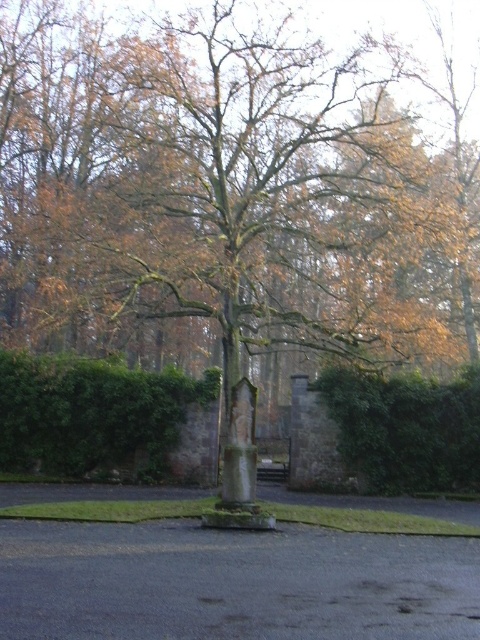
In the scene shown: You are a gardener planning to install a new sprinkler system between the green leafy hedge at center and the green leafy hedge at right. The sprinkler has a maximum coverage radius of 12 feet. Can the sprinkler effectively water both hedges without moving it?

The distance between the green leafy hedge at center and the green leafy hedge at right is 24.77 feet. Since the sprinkler has a maximum coverage radius of 12 feet, the total coverage diameter would be 24 feet. However, 24.77 feet exceeds this, so the sprinkler cannot effectively water both hedges without moving it.

You are standing in the paved area near the stone cross and want to walk to the green leafy hedge at right. Which direction should you move relative to the green leafy hedge at center?

You should move to the right of the green leafy hedge at center to reach the green leafy hedge at right.

You are a gardener who needs to trim the hedges in the image. You observe the green leafy hedge at center and the green leafy hedge at right. Which hedge requires more trimming to match their sizes?

The green leafy hedge at right requires more trimming because it is larger than the green leafy hedge at center.